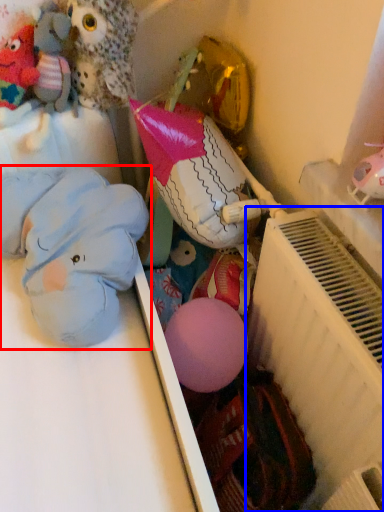
Question: Among these objects, which one is nearest to the camera, toy (highlighted by a red box) or radiator (highlighted by a blue box)?

Choices:
 (A) toy
 (B) radiator

Answer: (B)